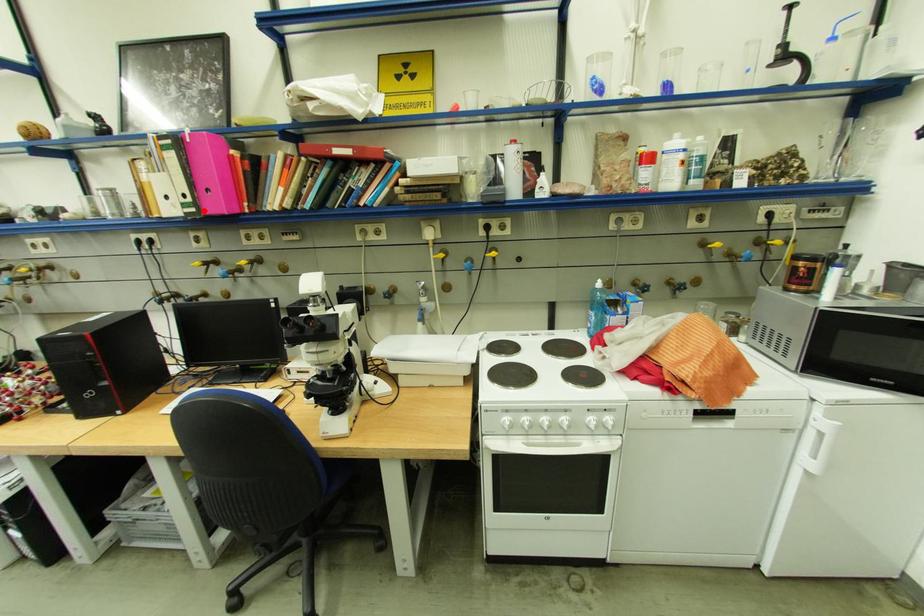
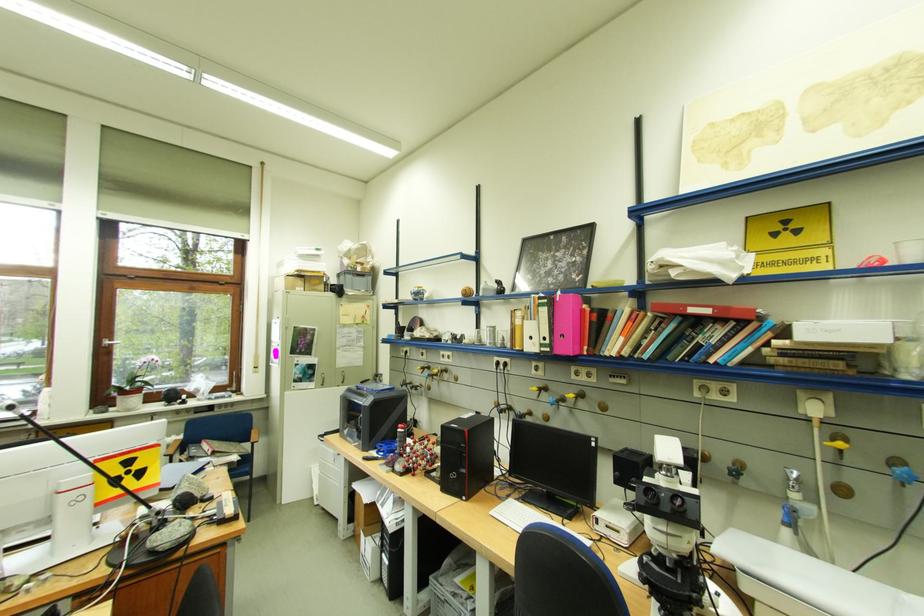
Where in the second image is the point corresponding to the highlighted location from the first image?

(558, 351)